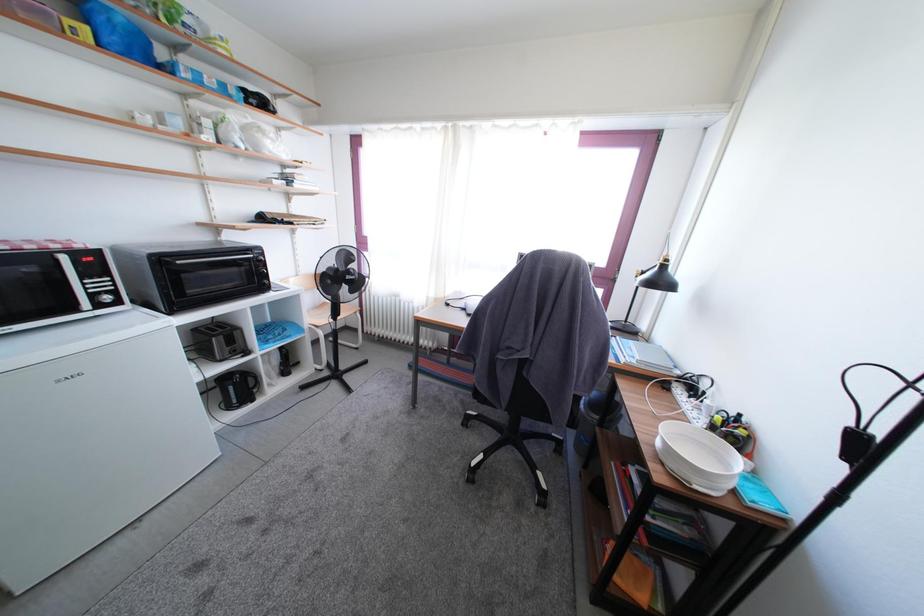
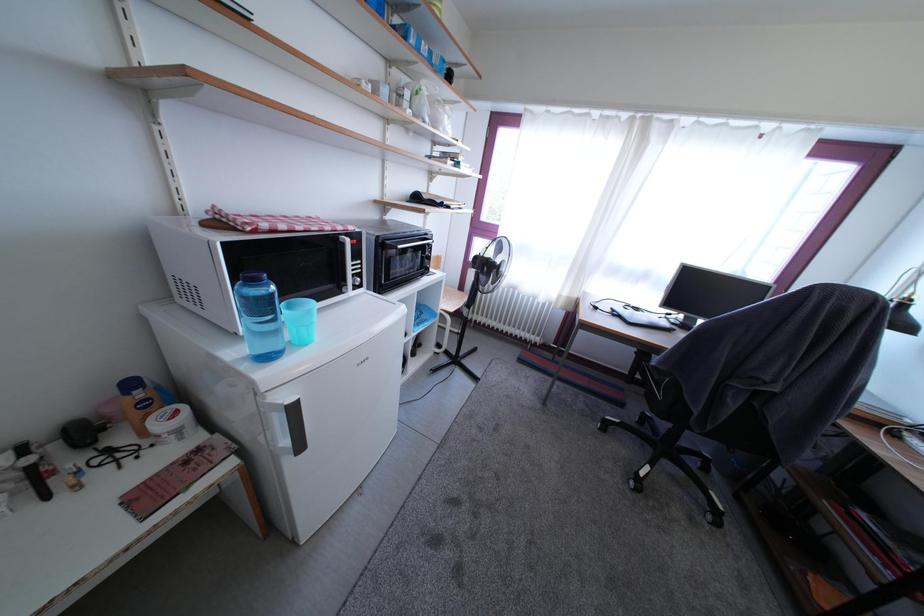
Question: The first image is from the beginning of the video and the second image is from the end. How did the camera likely rotate when shooting the video?

Choices:
 (A) Left
 (B) Right
 (C) Up
 (D) Down

Answer: (D)